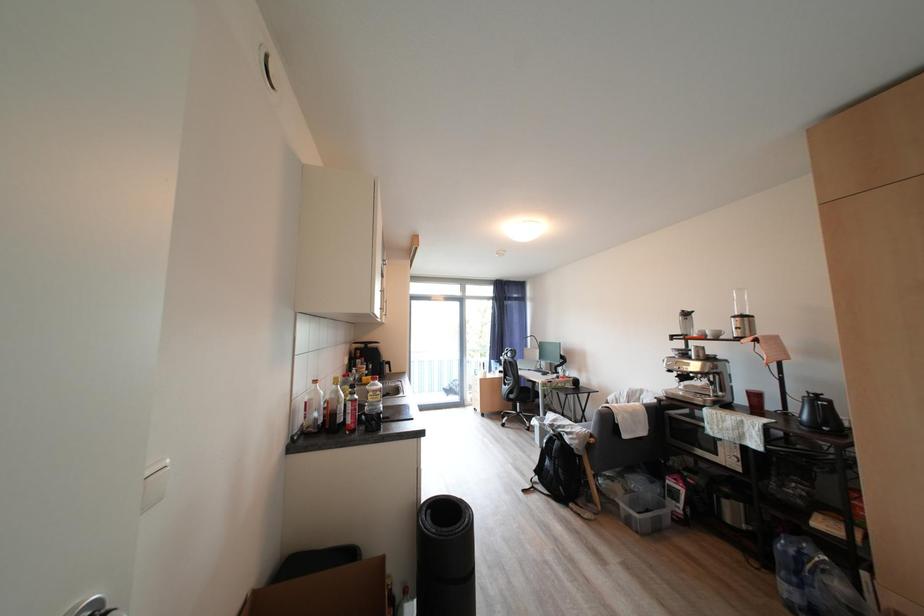
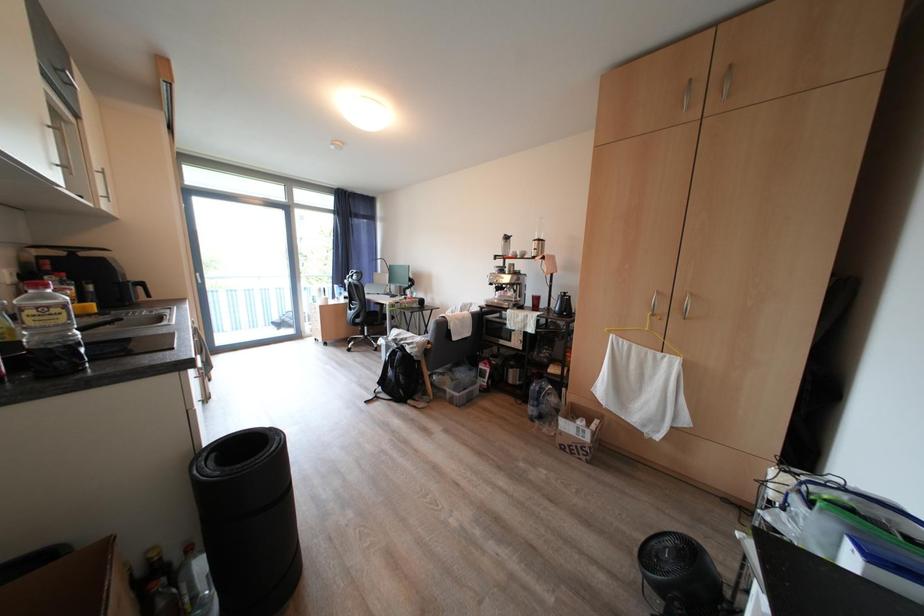
Question: How did the camera likely rotate?

Choices:
 (A) Left
 (B) Right
 (C) Up
 (D) Down

Answer: (B)